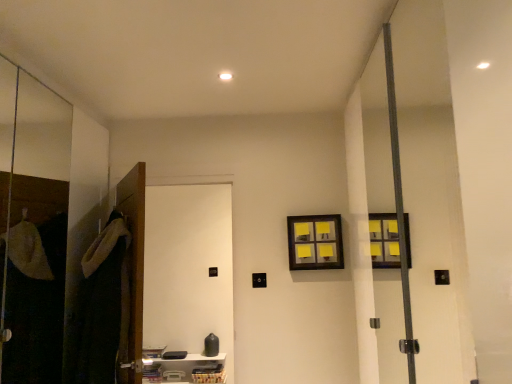
Question: Considering the relative sizes of transparent glass screen door at left, the second screen door viewed from the right, and yellow sticky notes at upper center in the image provided, is transparent glass screen door at left, the second screen door viewed from the right, bigger than yellow sticky notes at upper center?

Choices:
 (A) yes
 (B) no

Answer: (A)

Question: Is transparent glass screen door at left, the second screen door viewed from the right, thinner than yellow sticky notes at upper center?

Choices:
 (A) no
 (B) yes

Answer: (B)

Question: Is the depth of transparent glass screen door at left, the second screen door viewed from the right, greater than that of yellow sticky notes at upper center?

Choices:
 (A) no
 (B) yes

Answer: (A)

Question: From a real-world perspective, is transparent glass screen door at left, arranged as the first screen door when viewed from the left, on yellow sticky notes at upper center?

Choices:
 (A) no
 (B) yes

Answer: (B)

Question: Is transparent glass screen door at left, the second screen door viewed from the right, turned away from yellow sticky notes at upper center?

Choices:
 (A) yes
 (B) no

Answer: (B)

Question: Is transparent glass screen door at left, the second screen door viewed from the right, taller or shorter than white plastic shelf at lower center?

Choices:
 (A) tall
 (B) short

Answer: (A)

Question: From the image's perspective, relative to white plastic shelf at lower center, is transparent glass screen door at left, arranged as the first screen door when viewed from the left, above or below?

Choices:
 (A) below
 (B) above

Answer: (B)

Question: Considering the positions of transparent glass screen door at left, the second screen door viewed from the right, and white plastic shelf at lower center in the image, is transparent glass screen door at left, the second screen door viewed from the right, wider or thinner than white plastic shelf at lower center?

Choices:
 (A) thin
 (B) wide

Answer: (A)

Question: Does point (58, 352) appear closer or farther from the camera than point (201, 360)?

Choices:
 (A) farther
 (B) closer

Answer: (B)

Question: Considering the positions of white matte door at left, which is the 2th screen door in left-to-right order, and white plastic shelf at lower center in the image, is white matte door at left, which is the 2th screen door in left-to-right order, taller or shorter than white plastic shelf at lower center?

Choices:
 (A) tall
 (B) short

Answer: (A)

Question: From a real-world perspective, is white matte door at left, marked as the 1th screen door in a right-to-left arrangement, physically located above or below white plastic shelf at lower center?

Choices:
 (A) below
 (B) above

Answer: (B)

Question: Is point (190, 292) positioned closer to the camera than point (219, 365)?

Choices:
 (A) farther
 (B) closer

Answer: (A)

Question: Considering their positions, is white matte door at left, marked as the 1th screen door in a right-to-left arrangement, located in front of or behind white plastic shelf at lower center?

Choices:
 (A) front
 (B) behind

Answer: (A)

Question: From their relative heights in the image, would you say dark green fabric robe at left is taller or shorter than wooden door at left?

Choices:
 (A) tall
 (B) short

Answer: (B)

Question: Looking at the image, does dark green fabric robe at left seem bigger or smaller compared to wooden door at left?

Choices:
 (A) big
 (B) small

Answer: (A)